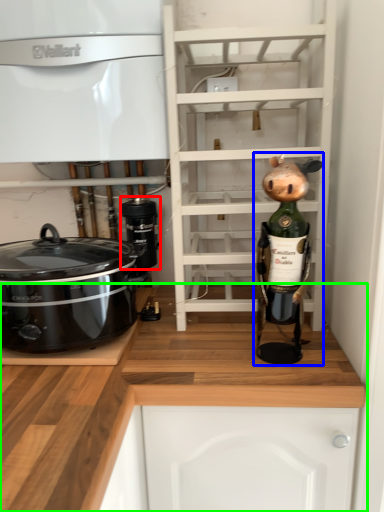
Question: Which object is positioned closest to appliance (highlighted by a red box)? Select from toy (highlighted by a blue box) and cabinetry (highlighted by a green box).

Choices:
 (A) toy
 (B) cabinetry

Answer: (B)